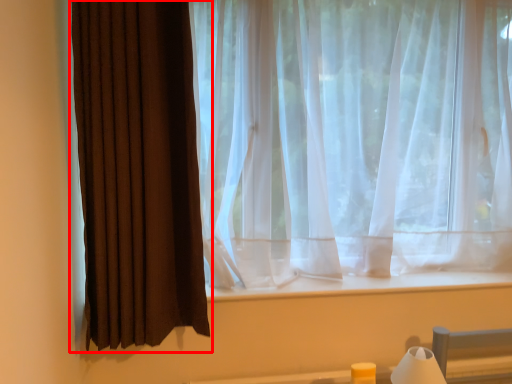
Question: From the image's perspective, what is the correct spatial positioning of curtain (annotated by the red box) in reference to table lamp?

Choices:
 (A) below
 (B) above

Answer: (B)